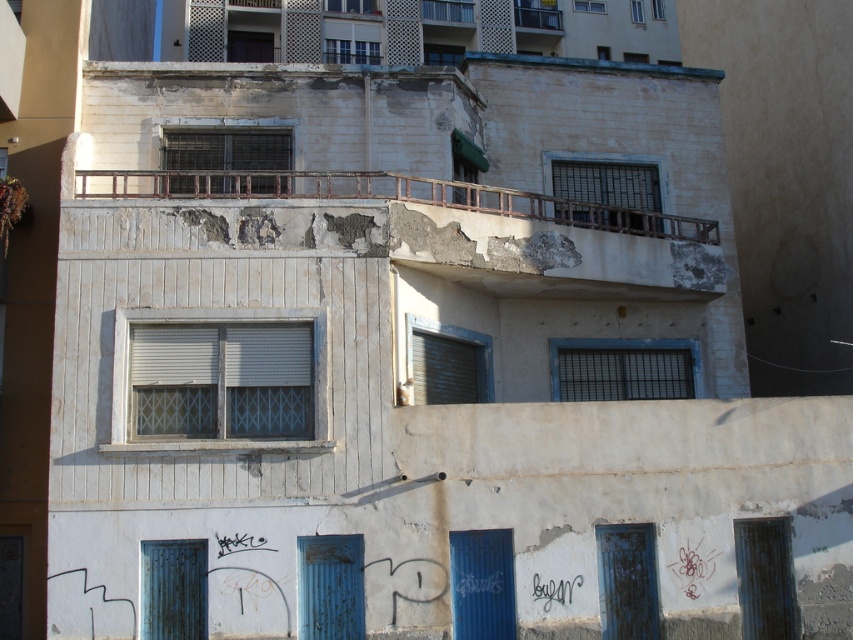
Can you confirm if black metal grid at upper center is positioned to the right of rusty metal shutter at lower center?

Indeed, black metal grid at upper center is positioned on the right side of rusty metal shutter at lower center.

How much distance is there between black metal grid at upper center and rusty metal shutter at lower center?

black metal grid at upper center is 15.68 feet from rusty metal shutter at lower center.

This screenshot has width=853, height=640. In order to click on black metal grid at upper center in this screenshot , I will do `click(624, 372)`.

Find the location of a particular element. The height and width of the screenshot is (640, 853). black metal grid at upper center is located at coordinates (624, 372).

Which is more to the right, rusty metal railing at upper center or white matte shutter at center?

rusty metal railing at upper center is more to the right.

Looking at this image, can you confirm if rusty metal railing at upper center is positioned above white matte shutter at center?

Indeed, rusty metal railing at upper center is positioned over white matte shutter at center.

What do you see at coordinates (473, 232) in the screenshot? This screenshot has width=853, height=640. I see `rusty metal railing at upper center` at bounding box center [473, 232].

This screenshot has height=640, width=853. I want to click on rusty metal railing at upper center, so click(x=473, y=232).

Is rusty metal railing at upper center in front of matte metal shutter at center?

No.

Is point (534, 234) closer to viewer compared to point (428, 364)?

No.

You are a GUI agent. You are given a task and a screenshot of the screen. Output one action in this format:
    pyautogui.click(x=<x>, y=<y>)
    Task: Click on the rusty metal railing at upper center
    Image resolution: width=853 pixels, height=640 pixels.
    Given the screenshot: What is the action you would take?
    pyautogui.click(x=473, y=232)